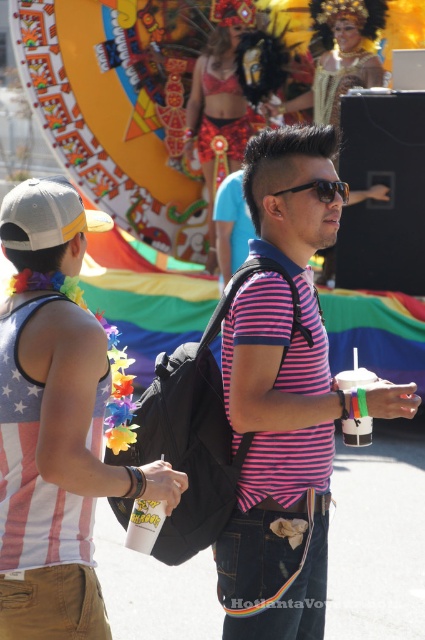
Question: Is american flag tank top at left wider than gray fabric baseball cap at left?

Choices:
 (A) no
 (B) yes

Answer: (B)

Question: Where is pink striped polo shirt at center located in relation to american flag tank top at left in the image?

Choices:
 (A) below
 (B) above

Answer: (B)

Question: Is gray fabric baseball cap at left to the right of sunglasses at center from the viewer's perspective?

Choices:
 (A) yes
 (B) no

Answer: (B)

Question: Which object is closer to the camera taking this photo?

Choices:
 (A) pink striped polo shirt at center
 (B) american flag tank top at left

Answer: (B)

Question: Which object is positioned farthest from the pink striped polo shirt at center?

Choices:
 (A) sunglasses at center
 (B) shiny red bikini at upper center
 (C) gray fabric baseball cap at left

Answer: (B)

Question: Among these objects, which one is nearest to the camera?

Choices:
 (A) shiny red bikini at upper center
 (B) american flag tank top at left
 (C) pink striped polo shirt at center
 (D) sunglasses at center

Answer: (B)